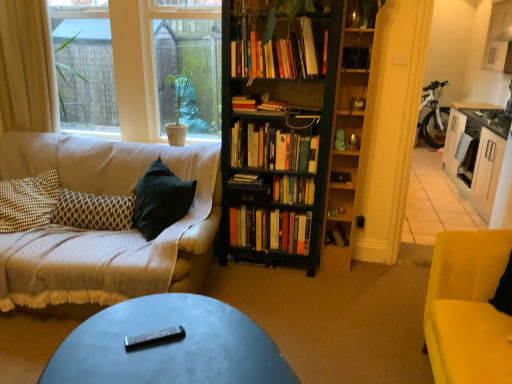
Describe the element at coordinates (244, 103) in the screenshot. I see `hardcover books at center, which ranks as the 7th book in bottom-to-top order` at that location.

Where is `hardcover book at center, which ranks as the 3th book in top-to-bottom order`? hardcover book at center, which ranks as the 3th book in top-to-bottom order is located at coordinates (273, 105).

What do you see at coordinates (94, 211) in the screenshot?
I see `patterned fabric pillow at left` at bounding box center [94, 211].

Identify the location of hardcover books at center, which ranks as the second book in top-to-bottom order. (244, 103).

Is black wooden bookcase at center not close to hardcover book at center, which is the sixth book in bottom-to-top order?

black wooden bookcase at center is near hardcover book at center, which is the sixth book in bottom-to-top order, not far away.

From a real-world perspective, who is located higher, black wooden bookcase at center or hardcover book at center, which is the sixth book in bottom-to-top order?

In real-world perspective, hardcover book at center, which is the sixth book in bottom-to-top order, is above.

Between black wooden bookcase at center and hardcover book at center, which is the sixth book in bottom-to-top order, which one has more height?

black wooden bookcase at center.

Is black wooden bookcase at center aimed at hardcover book at center, which ranks as the 3th book in top-to-bottom order?

Yes, black wooden bookcase at center is turned towards hardcover book at center, which ranks as the 3th book in top-to-bottom order.

Can you confirm if black wooden bookcase at center is taller than hardcover books at center, the first book in the top-to-bottom sequence?

Correct, black wooden bookcase at center is much taller as hardcover books at center, the first book in the top-to-bottom sequence.

Is hardcover books at center, the 8th book ordered from the bottom, at the back of black wooden bookcase at center?

That's right, black wooden bookcase at center is facing away from hardcover books at center, the 8th book ordered from the bottom.

Where is `the 1st book to the left when counting from the black wooden bookcase at center`? the 1st book to the left when counting from the black wooden bookcase at center is located at coordinates (280, 55).

Would you say hardcover book at center, arranged as the first book when ordered from the bottom, is outside metallic gray coffee table at center?

Yes, hardcover book at center, arranged as the first book when ordered from the bottom, is located beyond the bounds of metallic gray coffee table at center.

Considering the positions of points (329, 237) and (158, 324), is point (329, 237) closer to camera compared to point (158, 324)?

No, it is not.

Considering the sizes of objects hardcover book at center, which is the 8th book from top to bottom, and metallic gray coffee table at center in the image provided, who is taller, hardcover book at center, which is the 8th book from top to bottom, or metallic gray coffee table at center?

metallic gray coffee table at center is taller.

How different are the orientations of hardcover book at center, arranged as the first book when ordered from the bottom, and metallic gray coffee table at center in degrees?

The angle between the facing direction of hardcover book at center, arranged as the first book when ordered from the bottom, and the facing direction of metallic gray coffee table at center is 61.4 degrees.

Is the surface of white fabric curtain at left in direct contact with metallic gray coffee table at center?

No, white fabric curtain at left is not beside metallic gray coffee table at center.

Considering the relative positions of white fabric curtain at left and metallic gray coffee table at center in the image provided, is white fabric curtain at left to the right of metallic gray coffee table at center from the viewer's perspective?

In fact, white fabric curtain at left is to the left of metallic gray coffee table at center.

Between white fabric curtain at left and metallic gray coffee table at center, which one has larger size?

metallic gray coffee table at center.

Could you measure the distance between hardcover books at center, the 8th book ordered from the bottom, and white fabric curtain at left?

hardcover books at center, the 8th book ordered from the bottom, and white fabric curtain at left are 1.59 meters apart.

Could you tell me if hardcover books at center, the 8th book ordered from the bottom, is facing white fabric curtain at left?

No, hardcover books at center, the 8th book ordered from the bottom, does not turn towards white fabric curtain at left.

Does point (245, 69) lie in front of point (5, 84)?

Yes, point (245, 69) is in front of point (5, 84).

How different are the orientations of hardcover books at center, the 8th book ordered from the bottom, and white fabric curtain at left in degrees?

They differ by 2.99 degrees in their facing directions.

Which of these two, wooden cabinet at right or wooden shelf at right, is bigger?

Bigger between the two is wooden cabinet at right.

From a real-world perspective, does wooden cabinet at right stand above wooden shelf at right?

No, from a real-world perspective, wooden cabinet at right is not over wooden shelf at right

Can you confirm if wooden cabinet at right is positioned to the right of wooden shelf at right?

Correct, you'll find wooden cabinet at right to the right of wooden shelf at right.

Can we say wooden cabinet at right lies outside hardcover book at center, which is the 4th book from bottom to top?

Indeed, wooden cabinet at right is completely outside hardcover book at center, which is the 4th book from bottom to top.

You are a GUI agent. You are given a task and a screenshot of the screen. Output one action in this format:
    pyautogui.click(x=<x>, y=<y>)
    Task: Click on the entertainment center lying above the hardcover book at center, the 5th book when ordered from top to bottom (from the image's perspective)
    The height and width of the screenshot is (384, 512).
    Given the screenshot: What is the action you would take?
    pyautogui.click(x=476, y=152)

Would you consider wooden cabinet at right to be distant from hardcover book at center, the 5th book when ordered from top to bottom?

wooden cabinet at right is far away from hardcover book at center, the 5th book when ordered from top to bottom.

Locate an element on the screen. The width and height of the screenshot is (512, 384). the 3rd book behind the black wooden bookcase at center, counting from the anchor's position is located at coordinates (273, 105).

Identify the location of bookcase on the right of hardcover books at center, the 8th book ordered from the bottom. This screenshot has width=512, height=384. [x=293, y=139].

Estimate the real-world distances between objects in this image. Which object is further from black plastic remote control at center, metallic gray coffee table at center or hardcover books at center, which ranks as the second book in top-to-bottom order?

hardcover books at center, which ranks as the second book in top-to-bottom order, is further to black plastic remote control at center.

Based on their spatial positions, is hardcover book at center, arranged as the first book when ordered from the bottom, or wooden shelf at right closer to green matte plant at upper center?

Based on the image, wooden shelf at right appears to be nearer to green matte plant at upper center.

Looking at the image, which one is located further to clear glass window screen at upper left, white fabric curtain at left or black wooden bookcase at center?

Based on the image, black wooden bookcase at center appears to be further to clear glass window screen at upper left.

Estimate the real-world distances between objects in this image. Which object is further from wooden shelf at right, hardcover book at center, which is the sixth book in bottom-to-top order, or hardcover books at center, which ranks as the 7th book in bottom-to-top order?

hardcover books at center, which ranks as the 7th book in bottom-to-top order, is positioned further to the anchor wooden shelf at right.

Looking at the image, which one is located further to hardcover books at center, which is the sixth book in top-to-bottom order, hardcover books at center, the 8th book ordered from the bottom, or hardcover book at center, which is the 4th book from bottom to top?

hardcover books at center, the 8th book ordered from the bottom, lies further to hardcover books at center, which is the sixth book in top-to-bottom order, than the other object.

Looking at this image, from the image, which object appears to be nearer to hardcover books at center, which is the sixth book in top-to-bottom order, hardcover books at center, acting as the seventh book starting from the top, or hardcover book at center, which is the 8th book from top to bottom?

hardcover books at center, acting as the seventh book starting from the top, lies closer to hardcover books at center, which is the sixth book in top-to-bottom order, than the other object.

Looking at the image, which one is located closer to hardcover book at center, which is the sixth book in bottom-to-top order, hardcover book at center, arranged as the first book when ordered from the bottom, or metallic gray coffee table at center?

hardcover book at center, arranged as the first book when ordered from the bottom, is closer to hardcover book at center, which is the sixth book in bottom-to-top order.

From the image, which object appears to be farther from hardcover books at center, which ranks as the 7th book in bottom-to-top order, hardcover book at center, which is the sixth book in bottom-to-top order, or hardcover books at center, which is the sixth book in top-to-bottom order?

Based on the image, hardcover books at center, which is the sixth book in top-to-bottom order, appears to be further to hardcover books at center, which ranks as the 7th book in bottom-to-top order.

The image size is (512, 384). I want to click on bookcase situated between hardcover books at center, positioned as the 5th book in bottom-to-top order, and wooden cabinet at right from left to right, so click(293, 139).

The width and height of the screenshot is (512, 384). I want to click on houseplant located between clear glass window screen at upper left and hardcover book at center, which is the 8th book from top to bottom, in the left-right direction, so click(x=180, y=102).

You are a GUI agent. You are given a task and a screenshot of the screen. Output one action in this format:
    pyautogui.click(x=<x>, y=<y>)
    Task: Click on the pillow between metallic gray coffee table at center and green matte plant at upper center from front to back
    This screenshot has height=384, width=512.
    Given the screenshot: What is the action you would take?
    pyautogui.click(x=94, y=211)

Where is `book situated between white fabric curtain at left and hardcover books at center, which ranks as the second book in top-to-bottom order, from left to right`? The width and height of the screenshot is (512, 384). book situated between white fabric curtain at left and hardcover books at center, which ranks as the second book in top-to-bottom order, from left to right is located at coordinates (246, 181).